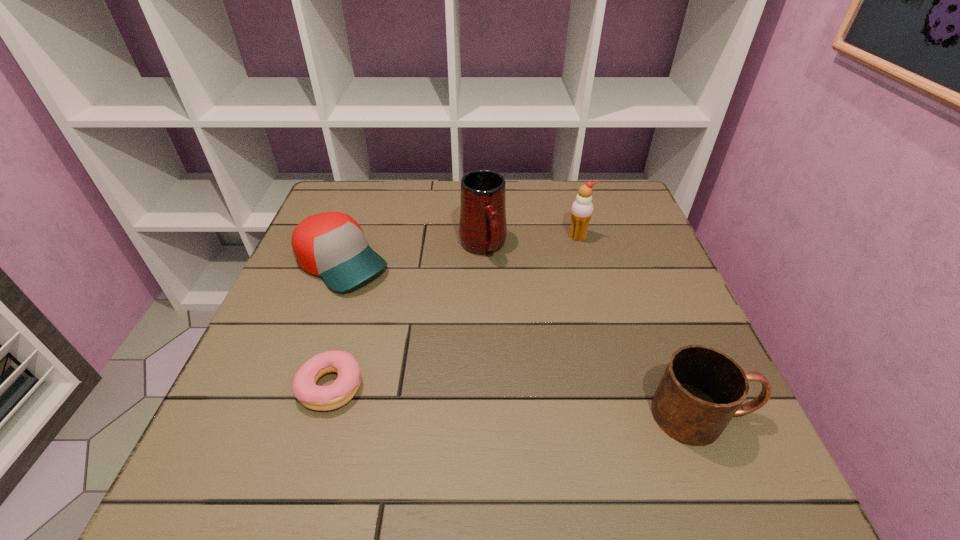
What are the coordinates of `vacant space located 0.310m at the brim of the baseball cap` in the screenshot? It's located at (469, 362).

This screenshot has height=540, width=960. I want to click on vacant space located at the front with a straw on the fourth object from left to right, so click(573, 282).

I want to click on vacant space positioned at the front with a straw on the fourth object from left to right, so click(568, 338).

Find the location of a particular element. Image resolution: width=960 pixels, height=540 pixels. free space located 0.220m at the front with a straw on the fourth object from left to right is located at coordinates (571, 303).

This screenshot has width=960, height=540. I want to click on free region located 0.320m on the side of the taller mug with the handle, so click(x=541, y=372).

Locate an element on the screen. This screenshot has width=960, height=540. vacant point located 0.200m on the side of the taller mug with the handle is located at coordinates (519, 326).

The height and width of the screenshot is (540, 960). In order to click on free location located 0.340m on the side of the taller mug with the handle in this screenshot , I will do `click(545, 381)`.

I want to click on object that is at the far edge, so click(482, 226).

I want to click on doughnut present at the near edge, so click(x=321, y=398).

The width and height of the screenshot is (960, 540). Find the location of `mug present at the near edge`. mug present at the near edge is located at coordinates (702, 388).